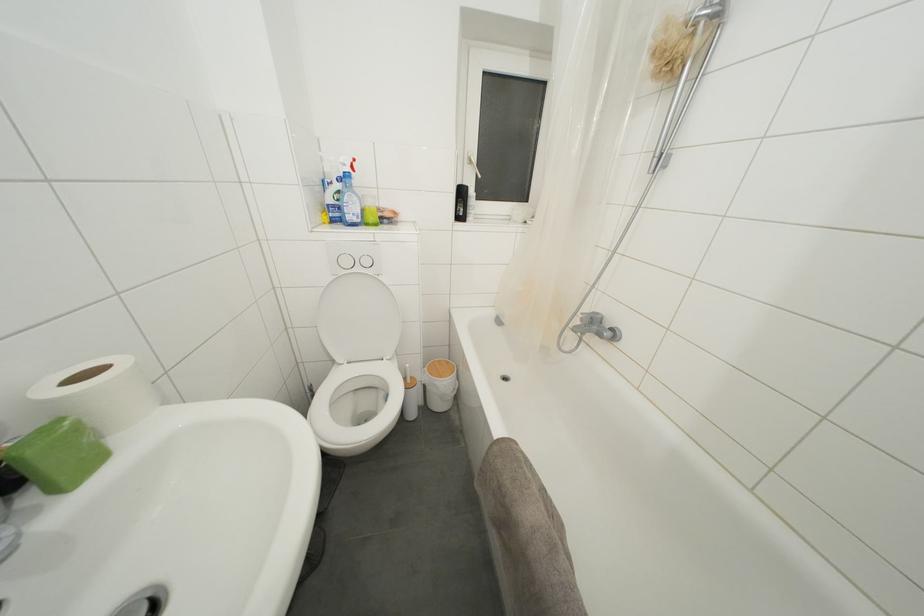
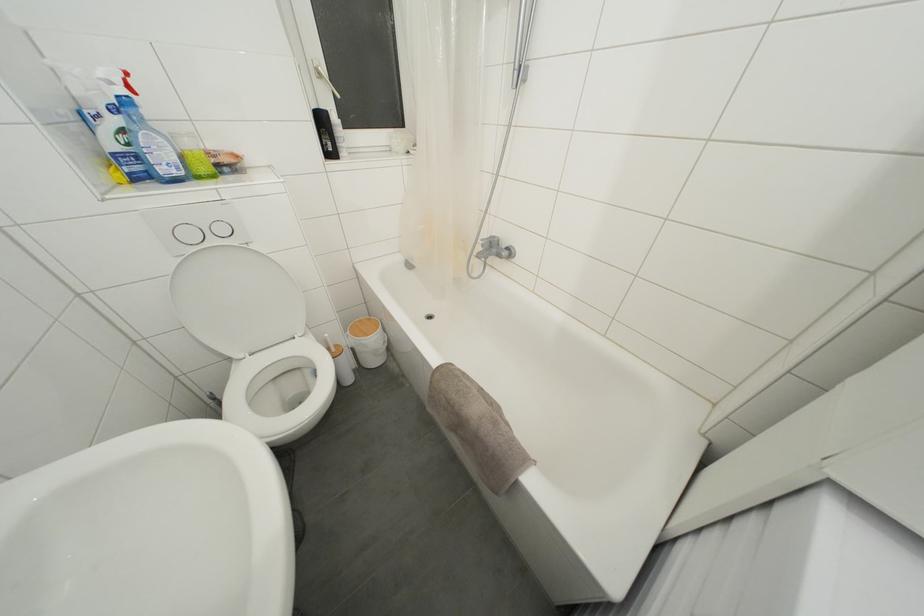
Where in the second image is the point corresponding to point 590,314 from the first image?

(488, 240)